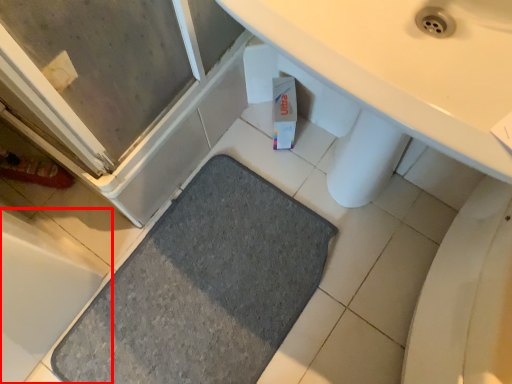
Question: From the image, what is the correct spatial relationship of bath (annotated by the red box) in relation to bath mat?

Choices:
 (A) right
 (B) left

Answer: (B)